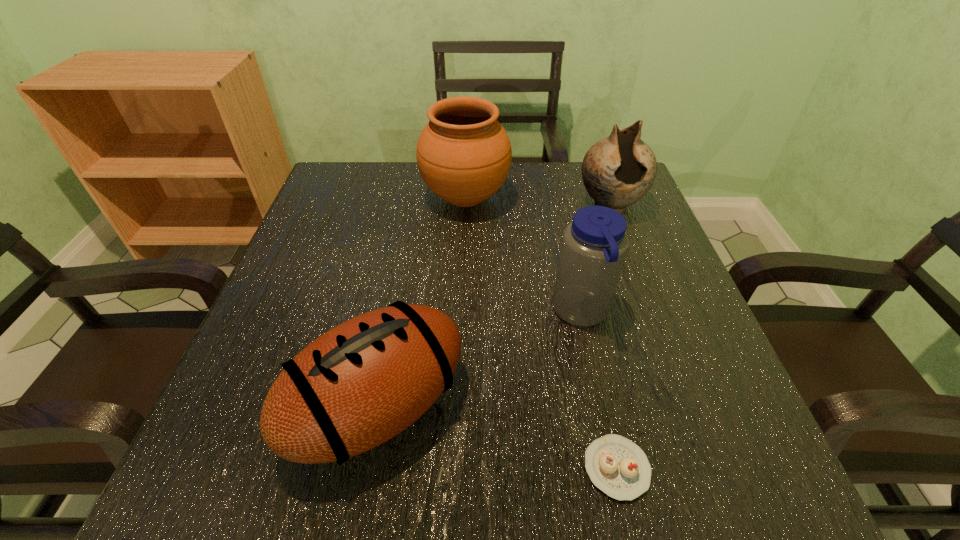
Where is `free space between the water bottle and the shortest object`? free space between the water bottle and the shortest object is located at coordinates (599, 390).

Identify the location of empty space that is in between the left pottery and the shortest object. (541, 333).

Locate which object ranks fourth in proximity to the third farthest object. Please provide its 2D coordinates. Your answer should be formatted as a tuple, i.e. [(x, y)], where the tuple contains the x and y coordinates of a point satisfying the conditions above.

[(464, 154)]

Point out which object is positioned as the third nearest to the right pottery. Please provide its 2D coordinates. Your answer should be formatted as a tuple, i.e. [(x, y)], where the tuple contains the x and y coordinates of a point satisfying the conditions above.

[(358, 385)]

You are a GUI agent. You are given a task and a screenshot of the screen. Output one action in this format:
    pyautogui.click(x=<x>, y=<y>)
    Task: Click on the free space that satisfies the following two spatial constraints: 1. on the front side of the shortest object; 2. on the left side of the left pottery
    Image resolution: width=960 pixels, height=540 pixels.
    Given the screenshot: What is the action you would take?
    pyautogui.click(x=454, y=468)

The height and width of the screenshot is (540, 960). I want to click on vacant point that satisfies the following two spatial constraints: 1. from the spout of the right pottery; 2. with a carrying loop on the side of the water bottle, so click(649, 313).